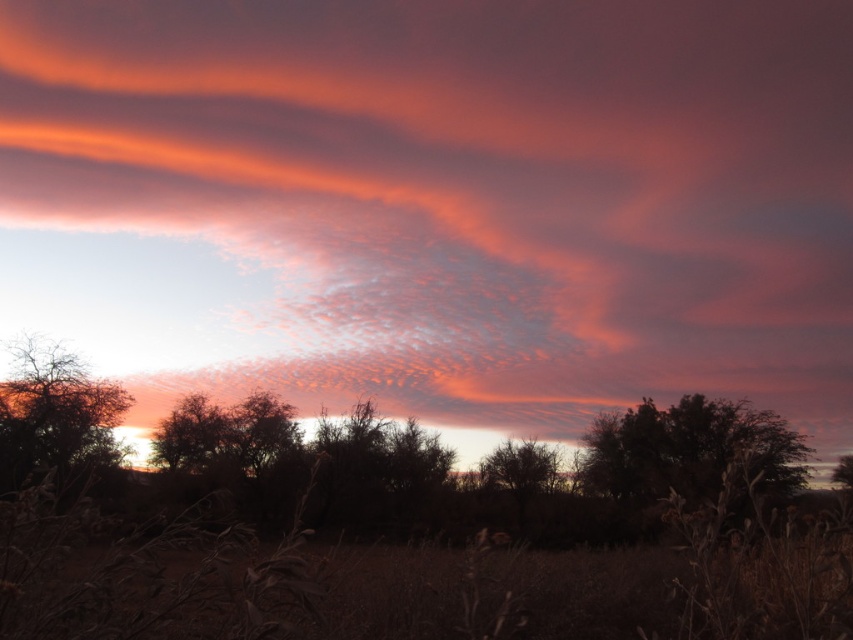
Question: Which point is closer to the camera?

Choices:
 (A) click(x=216, y=435)
 (B) click(x=519, y=465)
 (C) click(x=833, y=474)
 (D) click(x=86, y=378)

Answer: (D)

Question: Does silhouette leafy tree at center appear under silhouette tree at center?

Choices:
 (A) yes
 (B) no

Answer: (B)

Question: Among these points, which one is farthest from the camera?

Choices:
 (A) pyautogui.click(x=16, y=371)
 (B) pyautogui.click(x=500, y=460)
 (C) pyautogui.click(x=840, y=460)

Answer: (C)

Question: Can you confirm if silhouette leafy tree at center is bigger than silhouette leafy tree at lower right?

Choices:
 (A) yes
 (B) no

Answer: (A)

Question: Which of the following is the farthest from the observer?

Choices:
 (A) silhouette leafy tree at left
 (B) silhouette tree at center
 (C) silhouette leafy tree at lower right

Answer: (C)

Question: Can you confirm if silhouette leafy tree at left is bigger than silhouette leafy tree at lower right?

Choices:
 (A) no
 (B) yes

Answer: (B)